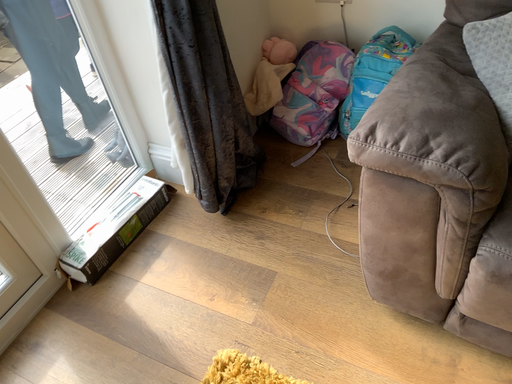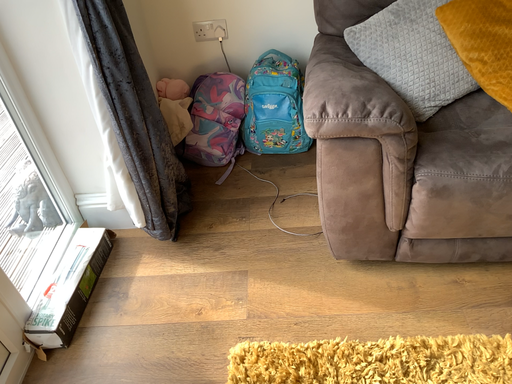
Question: Which way did the camera rotate in the video?

Choices:
 (A) rotated left
 (B) rotated right

Answer: (B)